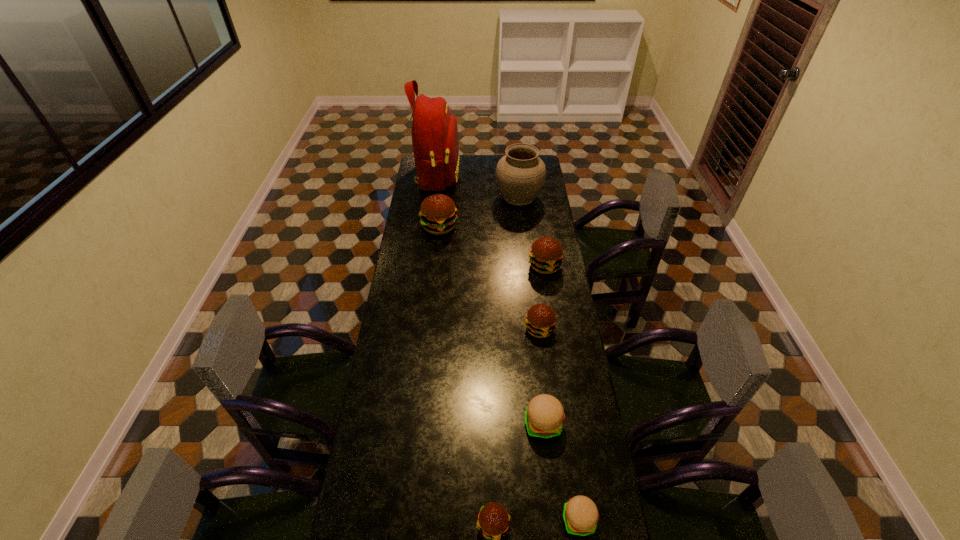
Identify the location of the bigger beige hamburger. (544, 417).

Where is `the nearer beige hamburger`? the nearer beige hamburger is located at coordinates (580, 514).

Locate an element on the screen. This screenshot has width=960, height=540. vacant area situated on the front-facing side of the pink backpack is located at coordinates (475, 176).

I want to click on vacant point located on the back of the seventh shortest object, so click(x=515, y=157).

Image resolution: width=960 pixels, height=540 pixels. I want to click on vacant space situated on the right of the third farthest object, so click(x=492, y=227).

Identify the location of free point located on the front of the fifth shortest object. (551, 309).

You are a GUI agent. You are given a task and a screenshot of the screen. Output one action in this format:
    pyautogui.click(x=<x>, y=<y>)
    Task: Click on the free space located 0.250m on the left of the fourth nearest hamburger
    Image resolution: width=960 pixels, height=540 pixels.
    Given the screenshot: What is the action you would take?
    (x=462, y=329)

Where is `free location located 0.270m on the back of the farther beige hamburger`? This screenshot has height=540, width=960. free location located 0.270m on the back of the farther beige hamburger is located at coordinates (535, 345).

Where is `vacant area situated 0.340m on the back of the nearer beige hamburger`? vacant area situated 0.340m on the back of the nearer beige hamburger is located at coordinates (562, 401).

Locate an element on the screen. object situated at the far edge is located at coordinates (435, 141).